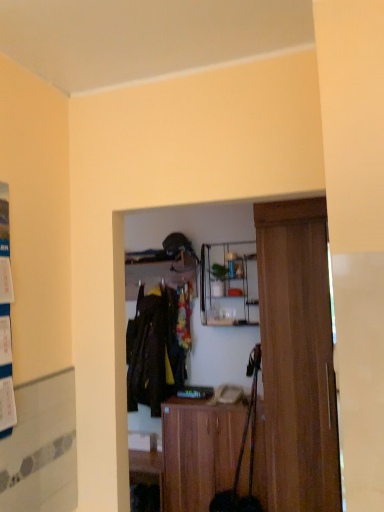
Question: Looking at the image, does clear glass shelf at center, the 1th shelf from the right, seem bigger or smaller compared to wooden cabinet at center?

Choices:
 (A) small
 (B) big

Answer: (A)

Question: From a real-world perspective, relative to wooden cabinet at center, is clear glass shelf at center, the 2th shelf viewed from the left, vertically above or below?

Choices:
 (A) below
 (B) above

Answer: (B)

Question: Considering the real-world distances, which object is closest to the wooden cabinet at center?

Choices:
 (A) wooden shelf at center, the 2th shelf in the right-to-left sequence
 (B) wooden door at right
 (C) dark brown fabric coat at center
 (D) clear glass shelf at center, the 1th shelf from the right
 (E) white paper poster at left

Answer: (B)

Question: Estimate the real-world distances between objects in this image. Which object is closer to the wooden cabinet at center?

Choices:
 (A) dark brown fabric coat at center
 (B) wooden door at right
 (C) clear glass shelf at center, the 1th shelf from the right
 (D) white paper poster at left
 (E) wooden shelf at center, the 1th shelf when ordered from left to right

Answer: (B)